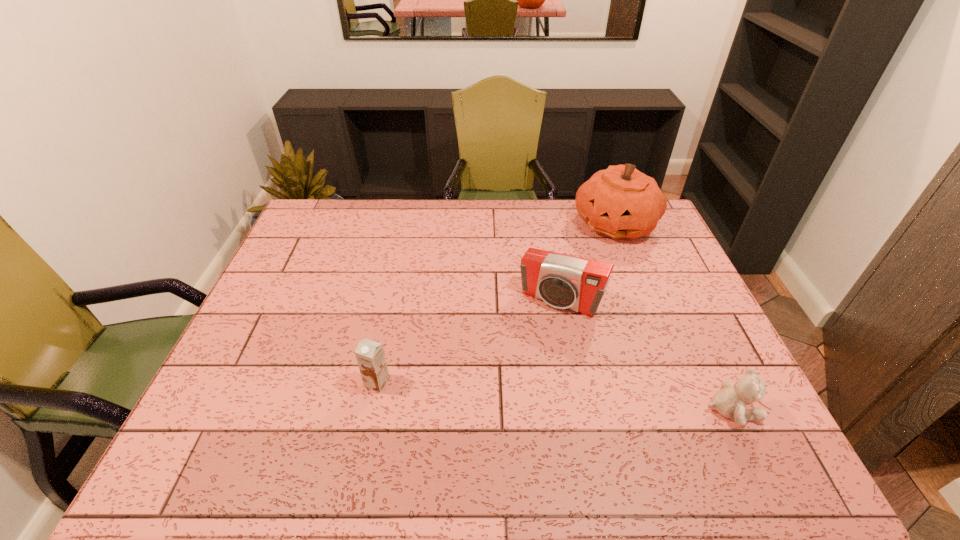
Image resolution: width=960 pixels, height=540 pixels. I want to click on free space located 0.300m on the front-facing side of the second farthest object, so click(497, 402).

Where is `vacant region located 0.230m on the front-facing side of the second farthest object`? vacant region located 0.230m on the front-facing side of the second farthest object is located at coordinates (510, 380).

At what (x,y) coordinates should I click in order to perform the action: click on object positioned at the far edge. Please return your answer as a coordinate pair (x, y). Image resolution: width=960 pixels, height=540 pixels. Looking at the image, I should click on (620, 202).

Locate an element on the screen. The image size is (960, 540). chocolate milk that is positioned at the near edge is located at coordinates (370, 356).

At what (x,y) coordinates should I click in order to perform the action: click on teddy bear located at the near edge. Please return your answer as a coordinate pair (x, y). The height and width of the screenshot is (540, 960). Looking at the image, I should click on (730, 402).

Locate an element on the screen. teddy bear present at the right edge is located at coordinates (730, 402).

At what (x,y) coordinates should I click in order to perform the action: click on pumpkin that is at the right edge. Please return your answer as a coordinate pair (x, y). This screenshot has width=960, height=540. Looking at the image, I should click on pos(620,202).

Locate an element on the screen. The width and height of the screenshot is (960, 540). object located at the far right corner is located at coordinates (620, 202).

Image resolution: width=960 pixels, height=540 pixels. I want to click on object that is at the near right corner, so coord(730,402).

Locate an element on the screen. Image resolution: width=960 pixels, height=540 pixels. vacant region at the far edge is located at coordinates (560, 224).